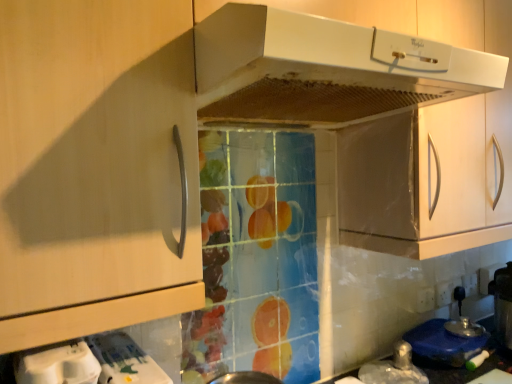
Question: Is the depth of white matte range hood at upper center less than that of blue plastic lid at lower right, the 3th appliance in the top-to-bottom sequence?

Choices:
 (A) yes
 (B) no

Answer: (A)

Question: Can you confirm if white matte range hood at upper center is taller than blue plastic lid at lower right, which appears as the 1th appliance when ordered from the bottom?

Choices:
 (A) no
 (B) yes

Answer: (B)

Question: Considering the relative sizes of white matte range hood at upper center and blue plastic lid at lower right, which appears as the 1th appliance when ordered from the bottom, in the image provided, is white matte range hood at upper center shorter than blue plastic lid at lower right, which appears as the 1th appliance when ordered from the bottom,?

Choices:
 (A) no
 (B) yes

Answer: (A)

Question: Does white matte range hood at upper center have a larger size compared to blue plastic lid at lower right, which appears as the 1th appliance when ordered from the bottom?

Choices:
 (A) no
 (B) yes

Answer: (B)

Question: From a real-world perspective, is white matte range hood at upper center below blue plastic lid at lower right, arranged as the first appliance when viewed from the back?

Choices:
 (A) yes
 (B) no

Answer: (B)

Question: Can you confirm if white matte range hood at upper center is wider than blue plastic lid at lower right, arranged as the first appliance when viewed from the back?

Choices:
 (A) no
 (B) yes

Answer: (B)

Question: Does blue plastic lid at lower right, the 3th appliance in the top-to-bottom sequence, turn towards white glossy water at lower left, which is counted as the second appliance, starting from the back?

Choices:
 (A) yes
 (B) no

Answer: (B)

Question: From a real-world perspective, is blue plastic lid at lower right, marked as the 1th appliance in a right-to-left arrangement, physically above white glossy water at lower left, which ranks as the 2th appliance in right-to-left order?

Choices:
 (A) no
 (B) yes

Answer: (A)

Question: Would you consider blue plastic lid at lower right, marked as the 1th appliance in a right-to-left arrangement, to be distant from white glossy water at lower left, which is counted as the second appliance, starting from the back?

Choices:
 (A) no
 (B) yes

Answer: (B)

Question: Is blue plastic lid at lower right, marked as the third appliance in a left-to-right arrangement, looking in the opposite direction of white glossy water at lower left, which is counted as the second appliance, starting from the back?

Choices:
 (A) no
 (B) yes

Answer: (A)

Question: Is blue plastic lid at lower right, marked as the 3th appliance in a front-to-back arrangement, at the right side of white glossy water at lower left, placed as the second appliance when sorted from top to bottom?

Choices:
 (A) yes
 (B) no

Answer: (A)

Question: Is blue plastic lid at lower right, the 3th appliance in the top-to-bottom sequence, positioned in front of white glossy water at lower left, the 2th appliance from the front?

Choices:
 (A) no
 (B) yes

Answer: (A)

Question: Is white plastic container at lower left, marked as the third appliance in a back-to-front arrangement, wider than white matte range hood at upper center?

Choices:
 (A) no
 (B) yes

Answer: (A)